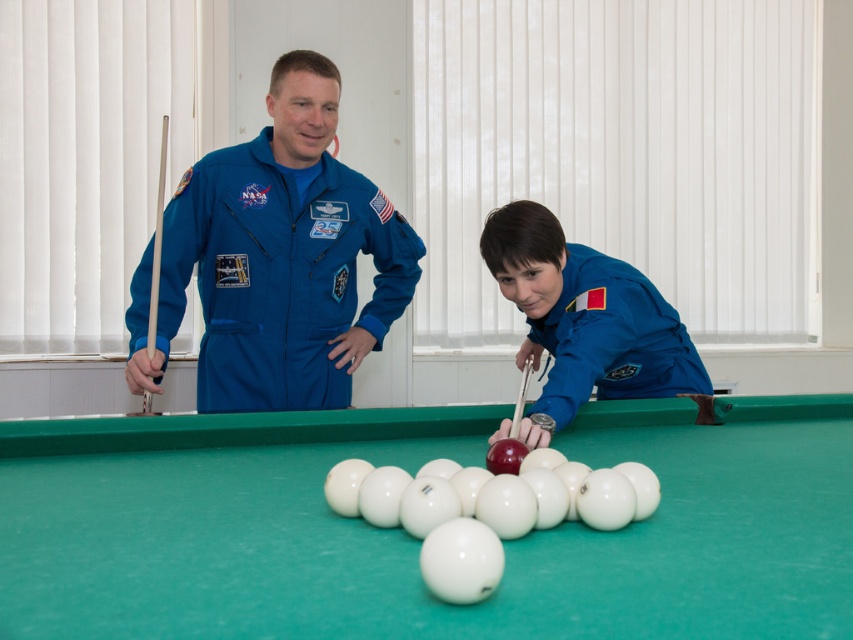
Question: Considering the relative positions of green felt billiard table at center and wooden at left in the image provided, where is green felt billiard table at center located with respect to wooden at left?

Choices:
 (A) above
 (B) below

Answer: (B)

Question: Is blue fabric astronaut suit at left bigger than blue fabric astronaut at center?

Choices:
 (A) yes
 (B) no

Answer: (A)

Question: Which point is closer to the camera?

Choices:
 (A) blue fabric astronaut at center
 (B) green felt billiard table at center
 (C) wooden at left

Answer: (B)

Question: Does green felt billiard table at center have a larger size compared to blue fabric astronaut at center?

Choices:
 (A) no
 (B) yes

Answer: (A)

Question: Which point appears closest to the camera in this image?

Choices:
 (A) (521, 406)
 (B) (511, 266)
 (C) (149, 289)
 (D) (167, 284)

Answer: (A)

Question: Considering the real-world distances, which object is closest to the blue fabric astronaut at center?

Choices:
 (A) matte wood cue at center
 (B) blue fabric astronaut suit at left

Answer: (A)